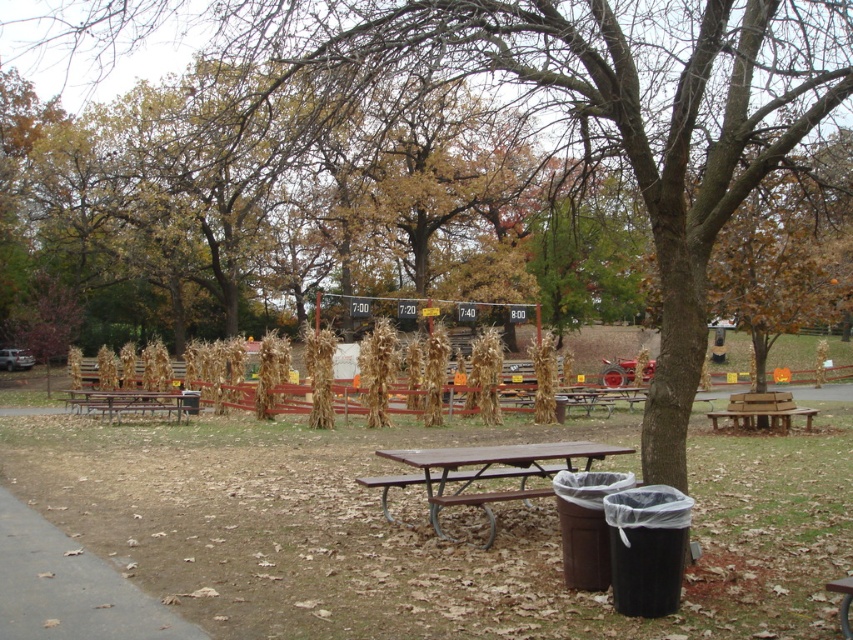
Does brown metal picnic table at center have a larger size compared to brown wooden picnic table at lower left?

Correct, brown metal picnic table at center is larger in size than brown wooden picnic table at lower left.

This screenshot has height=640, width=853. Describe the element at coordinates (482, 474) in the screenshot. I see `brown metal picnic table at center` at that location.

Who is more forward, (x=434, y=516) or (x=109, y=419)?

Point (x=434, y=516) is in front.

Find the location of a particular element. The height and width of the screenshot is (640, 853). brown metal picnic table at center is located at coordinates (482, 474).